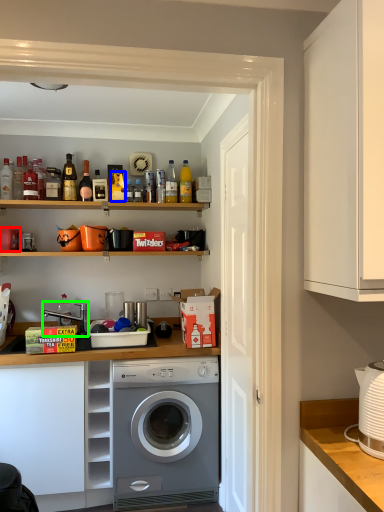
Question: Considering the real-world distances, which object is farthest from appliance (highlighted by a red box)? bottle (highlighted by a blue box) or sink (highlighted by a green box)?

Choices:
 (A) bottle
 (B) sink

Answer: (A)